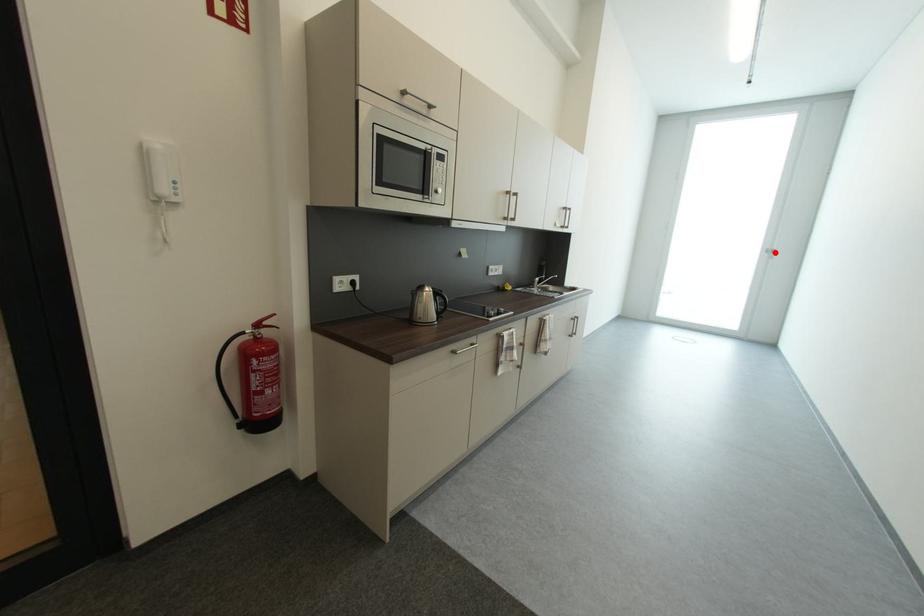
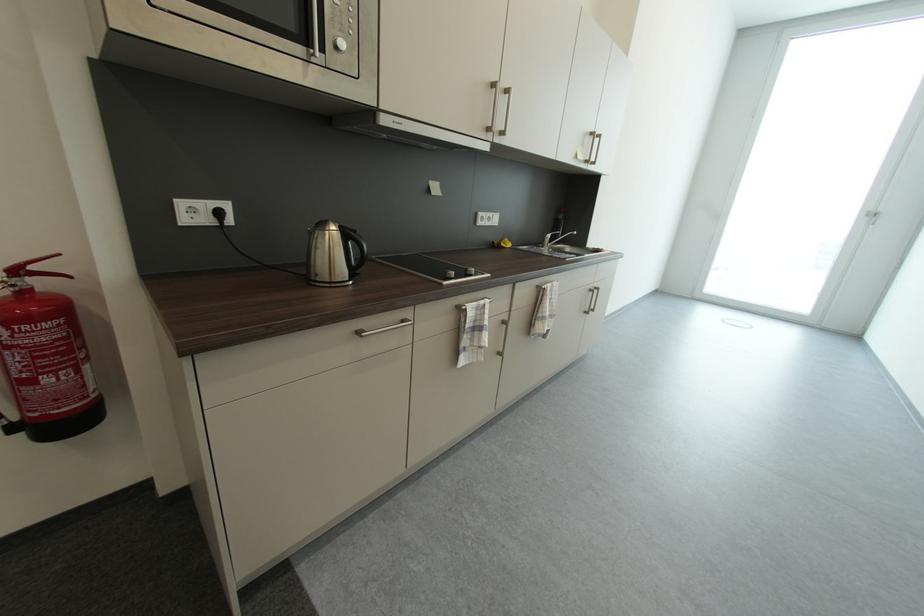
In the second image, find the point that corresponds to the highlighted location in the first image.

(878, 217)